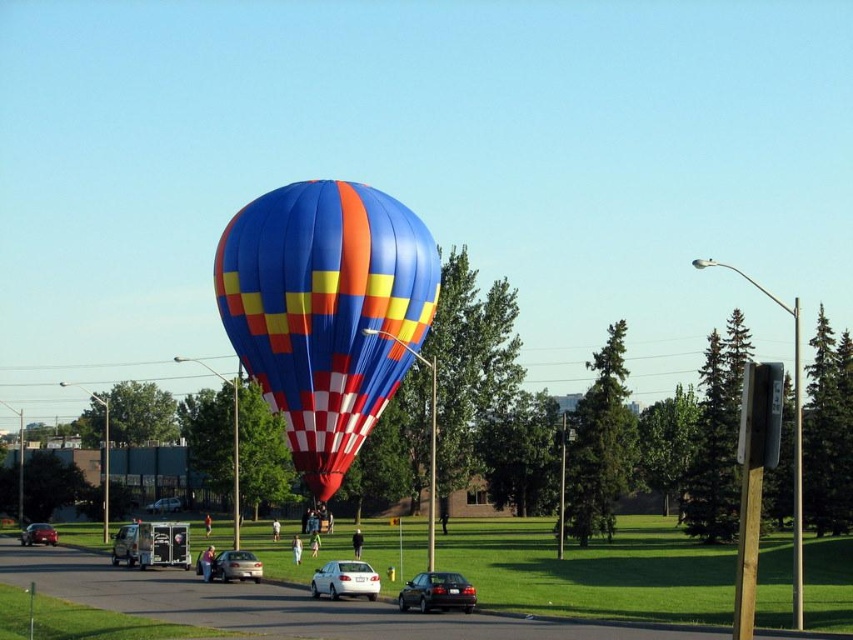
You are standing on the side of the road and see the shiny black sedan at center and the silver metallic sedan at center. Which one is closer to the hot air balloon?

The shiny black sedan at center is to the right of the silver metallic sedan at center, so the silver metallic sedan at center is closer to the hot air balloon.

You are a photographer trying to capture both the shiny silver sedan at lower left and the silver metallic car at center in a single shot. Since you want to ensure both are fully visible, which car should you adjust your camera angle to focus on first to account for their heights?

The shiny silver sedan at lower left is taller than the silver metallic car at center, so you should focus on adjusting your camera angle to include the taller shiny silver sedan at lower left first to ensure both vehicles are fully visible in the photo.

You are standing on the road and see the silver metallic sedan at center and the shiny silver sedan at lower left. Which car is closer to your right side?

The silver metallic sedan at center is to the right of the shiny silver sedan at lower left, so if you are facing the scene, the silver metallic sedan at center would be closer to your right side.